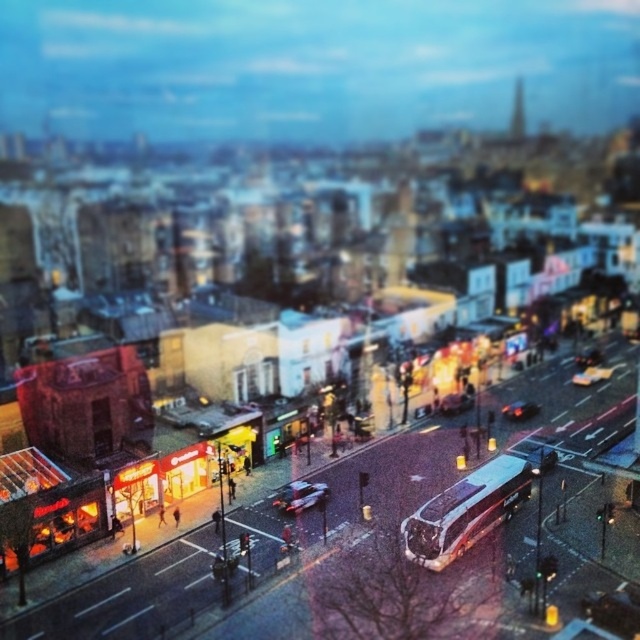
Is metallic silver car at center to the right of shiny black car at center from the viewer's perspective?

Incorrect, metallic silver car at center is not on the right side of shiny black car at center.

Between metallic silver car at center and shiny black car at center, which one appears on the left side from the viewer's perspective?

Positioned to the left is metallic silver car at center.

Who is more forward, (296,506) or (531,413)?

Positioned in front is point (296,506).

The height and width of the screenshot is (640, 640). Find the location of `metallic silver car at center`. metallic silver car at center is located at coordinates (300, 496).